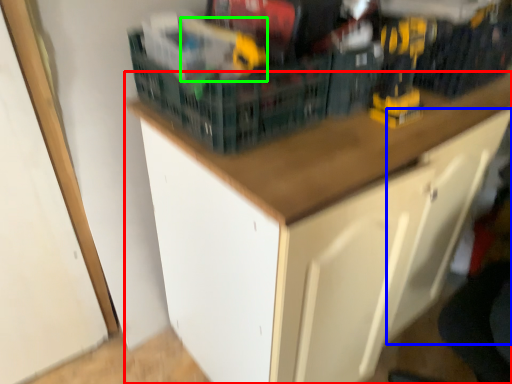
Question: Which object is the closest to the cabinetry (highlighted by a red box)? Choose among these: drawer (highlighted by a blue box) or toy (highlighted by a green box).

Choices:
 (A) drawer
 (B) toy

Answer: (A)